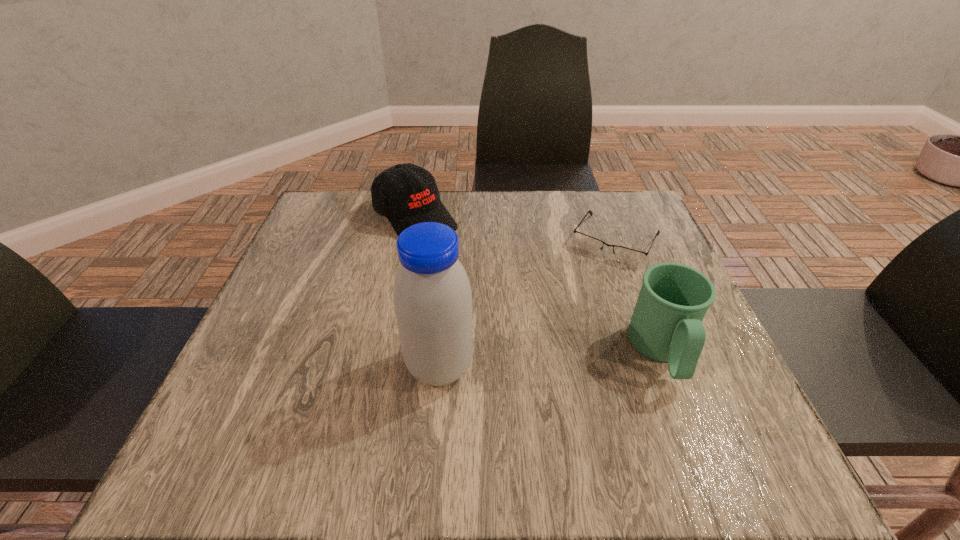
In the image, there is a desktop. Where is `free space at the far edge`? The width and height of the screenshot is (960, 540). free space at the far edge is located at coordinates (566, 191).

Identify the location of blank space at the near edge of the desktop. Image resolution: width=960 pixels, height=540 pixels. (511, 409).

Locate an element on the screen. Image resolution: width=960 pixels, height=540 pixels. free space at the left edge is located at coordinates (282, 310).

I want to click on vacant space at the right edge of the desktop, so click(x=662, y=244).

At what (x,y) coordinates should I click in order to perform the action: click on free space at the far left corner. Please return your answer as a coordinate pair (x, y). Looking at the image, I should click on (350, 190).

This screenshot has height=540, width=960. Find the location of `vacant space in between the mug and the spectacles`. vacant space in between the mug and the spectacles is located at coordinates (638, 296).

Where is `unoccupied position between the spectacles and the mug`? This screenshot has width=960, height=540. unoccupied position between the spectacles and the mug is located at coordinates (638, 296).

I want to click on unoccupied area between the baseball cap and the mug, so click(x=539, y=285).

Image resolution: width=960 pixels, height=540 pixels. I want to click on free space between the tallest object and the spectacles, so click(x=528, y=303).

The image size is (960, 540). I want to click on vacant region between the spectacles and the baseball cap, so click(x=516, y=230).